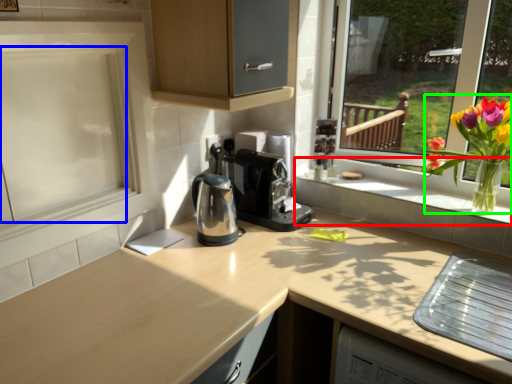
Question: Based on their relative distances, which object is farther from window sill (highlighted by a red box)? Choose from screen door (highlighted by a blue box) and floral arrangement (highlighted by a green box).

Choices:
 (A) screen door
 (B) floral arrangement

Answer: (A)